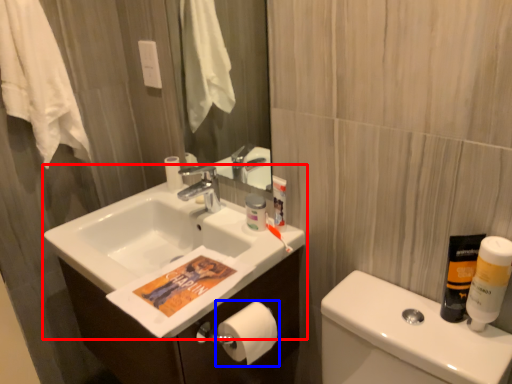
Question: Which of the following is the farthest to the observer, sink (highlighted by a red box) or toilet paper (highlighted by a blue box)?

Choices:
 (A) sink
 (B) toilet paper

Answer: (B)